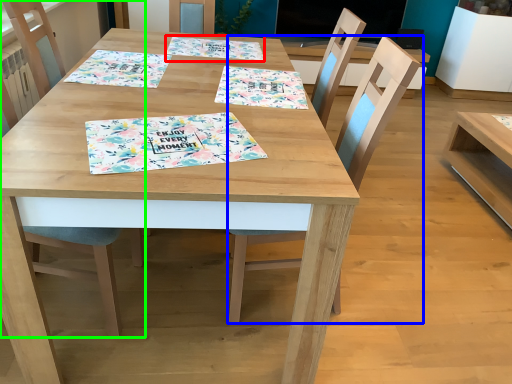
Question: Based on their relative distances, which object is farther from tablecloth (highlighted by a red box)? Choose from chair (highlighted by a blue box) and chair (highlighted by a green box).

Choices:
 (A) chair
 (B) chair

Answer: (B)